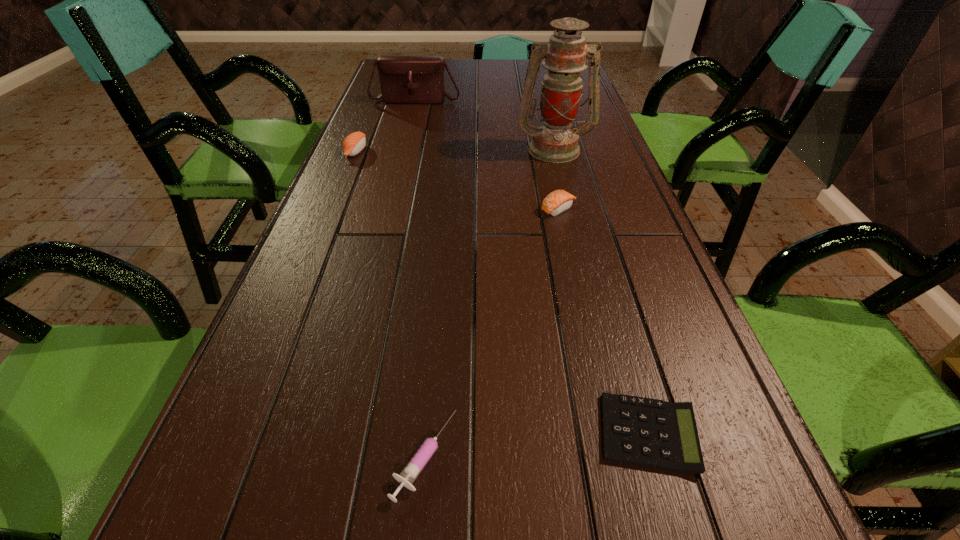
You are a GUI agent. You are given a task and a screenshot of the screen. Output one action in this format:
    pyautogui.click(x=<x>, y=<y>)
    Task: Click on the free spot at the far edge of the desktop
    
    Given the screenshot: What is the action you would take?
    pyautogui.click(x=527, y=63)

You are a GUI agent. You are given a task and a screenshot of the screen. Output one action in this format:
    pyautogui.click(x=<x>, y=<y>)
    Task: Click on the vacant space at the left edge of the desktop
    
    Given the screenshot: What is the action you would take?
    pyautogui.click(x=292, y=271)

In the image, there is a desktop. At what (x,y) coordinates should I click in order to perform the action: click on vacant space at the right edge. Please return your answer as a coordinate pair (x, y). The image size is (960, 540). Looking at the image, I should click on (586, 95).

Where is `vacant area between the shortest object and the farthest object`? vacant area between the shortest object and the farthest object is located at coordinates (532, 266).

Locate an element on the screen. The width and height of the screenshot is (960, 540). blank region between the farther sushi and the oil lamp is located at coordinates [455, 150].

The width and height of the screenshot is (960, 540). I want to click on vacant area that lies between the oil lamp and the fourth farthest object, so pyautogui.click(x=556, y=179).

In order to click on free spot between the shortest object and the fifth shortest object in this screenshot , I will do `click(532, 266)`.

At what (x,y) coordinates should I click in order to perform the action: click on empty space between the fifth tallest object and the tallest object. Please return your answer as a coordinate pair (x, y). Image resolution: width=960 pixels, height=540 pixels. Looking at the image, I should click on click(489, 303).

Image resolution: width=960 pixels, height=540 pixels. Find the location of `empty location between the right sushi and the shortest object`. empty location between the right sushi and the shortest object is located at coordinates (603, 321).

Locate an element on the screen. Image resolution: width=960 pixels, height=540 pixels. vacant area that lies between the left sushi and the fifth tallest object is located at coordinates (390, 304).